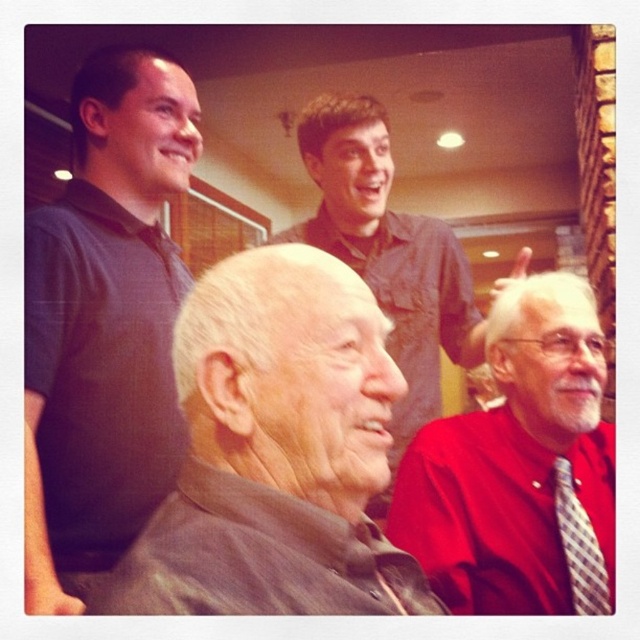
Between brown leather jacket at center and plaid fabric tie at right, which one appears on the left side from the viewer's perspective?

From the viewer's perspective, brown leather jacket at center appears more on the left side.

This screenshot has height=640, width=640. Describe the element at coordinates (275, 452) in the screenshot. I see `brown leather jacket at center` at that location.

Locate an element on the screen. This screenshot has height=640, width=640. brown leather jacket at center is located at coordinates (275, 452).

Locate an element on the screen. The image size is (640, 640). brown leather jacket at center is located at coordinates (275, 452).

From the picture: Does dark gray polo shirt at upper left come in front of red smooth shirt at lower right?

That is True.

Which of these two, dark gray polo shirt at upper left or red smooth shirt at lower right, stands taller?

Standing taller between the two is dark gray polo shirt at upper left.

Is point (134, 259) positioned in front of point (580, 422)?

No, (134, 259) is further to viewer.

Locate an element on the screen. The image size is (640, 640). dark gray polo shirt at upper left is located at coordinates (104, 323).